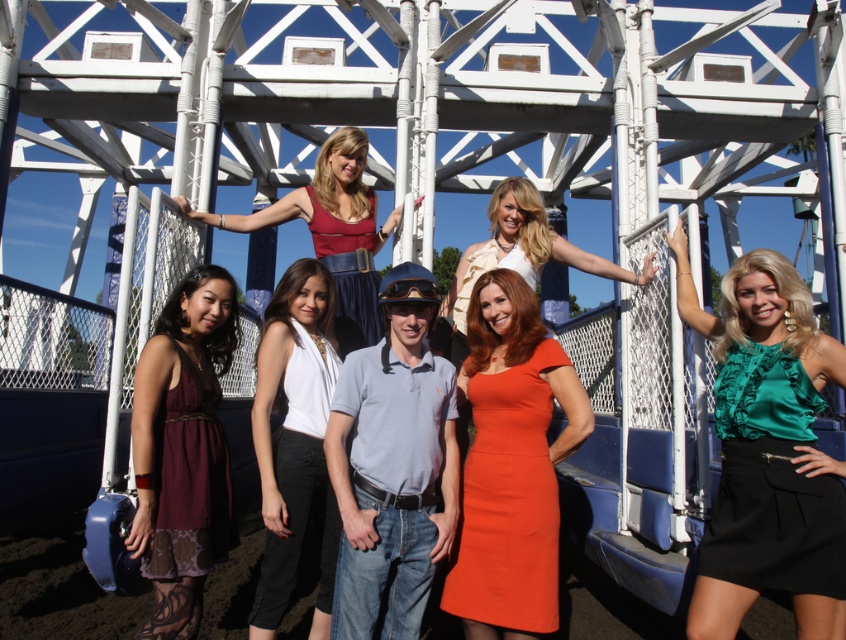
Question: Can you confirm if orange matte dress at center is positioned below matte red dress at center?

Choices:
 (A) yes
 (B) no

Answer: (A)

Question: Which point appears closest to the camera in this image?

Choices:
 (A) (742, 502)
 (B) (202, 404)
 (C) (273, 484)
 (D) (375, 337)

Answer: (A)

Question: Can you confirm if white satin blouse at center is positioned below burgundy satin dress at lower left?

Choices:
 (A) no
 (B) yes

Answer: (A)

Question: Among these points, which one is farthest from the camera?

Choices:
 (A) (254, 618)
 (B) (341, 355)
 (C) (402, 429)

Answer: (B)

Question: Is white satin dress at center smaller than matte blue dress at center?

Choices:
 (A) yes
 (B) no

Answer: (B)

Question: Which point is closer to the camera taking this photo?

Choices:
 (A) (432, 496)
 (B) (841, 536)
 (C) (501, 611)
 (D) (305, 429)

Answer: (B)